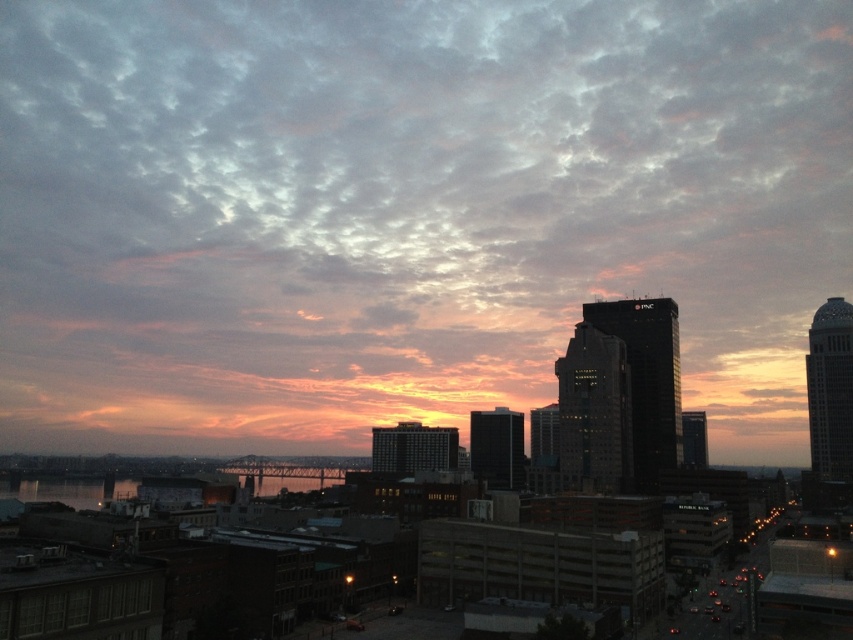
Question: Is cloudy sky at upper center smaller than reflective glass water at center?

Choices:
 (A) no
 (B) yes

Answer: (A)

Question: Which point is closer to the camera taking this photo?

Choices:
 (A) (90, 420)
 (B) (260, 492)

Answer: (B)

Question: Which object appears farthest from the camera in this image?

Choices:
 (A) reflective glass water at center
 (B) cloudy sky at upper center

Answer: (B)

Question: Observing the image, what is the correct spatial positioning of cloudy sky at upper center in reference to reflective glass water at center?

Choices:
 (A) left
 (B) right

Answer: (B)

Question: Considering the relative positions of cloudy sky at upper center and reflective glass water at center in the image provided, where is cloudy sky at upper center located with respect to reflective glass water at center?

Choices:
 (A) below
 (B) above

Answer: (B)